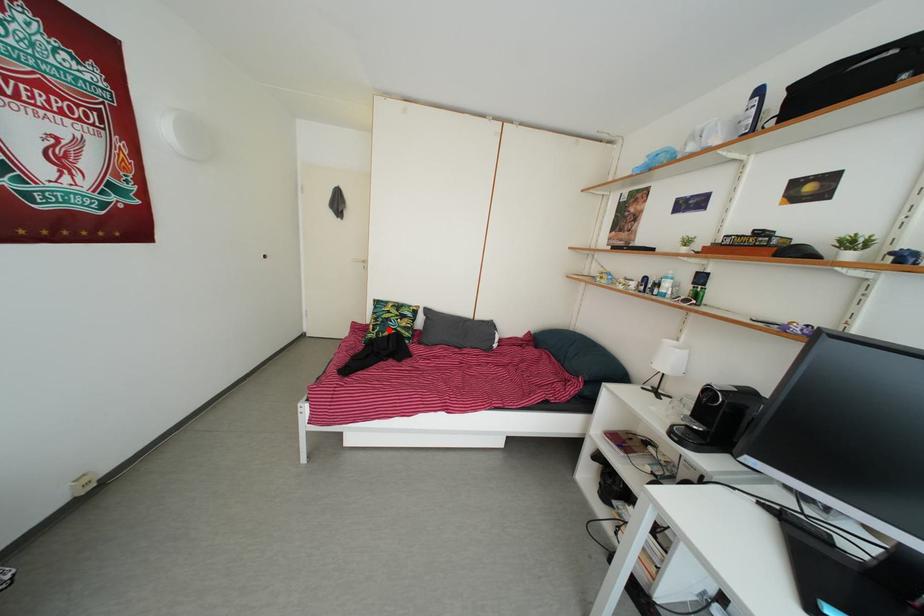
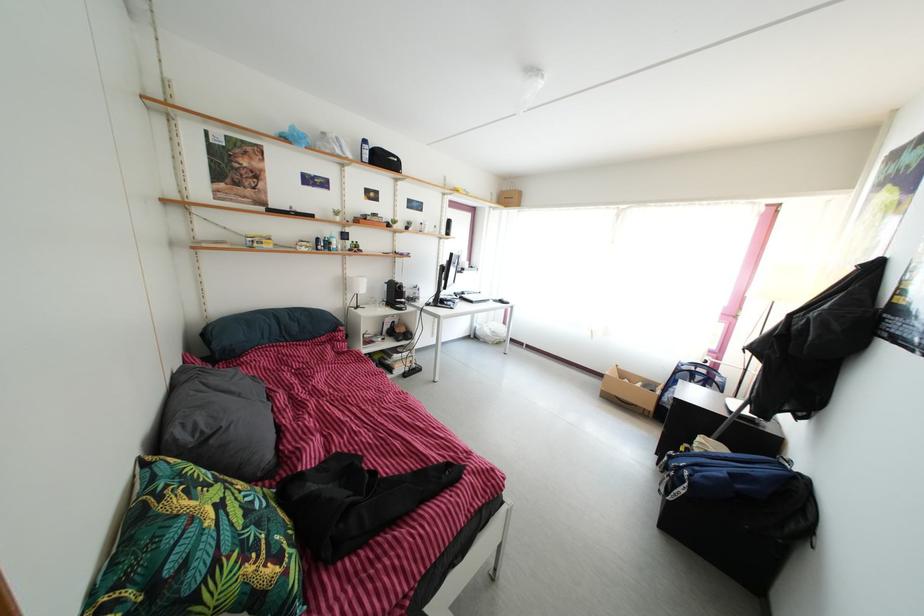
Locate, in the second image, the point that corresponds to the highlighted location in the first image.

(264, 533)